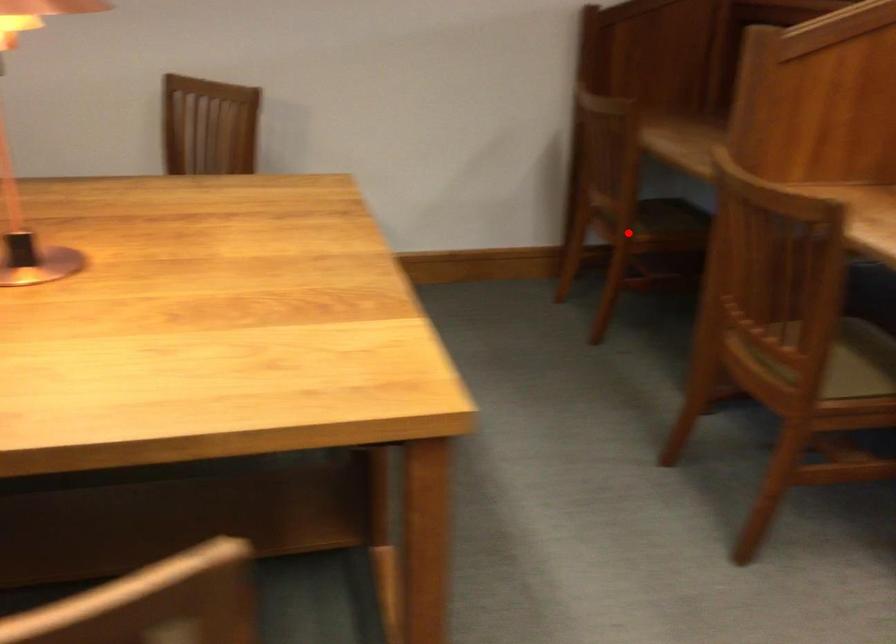
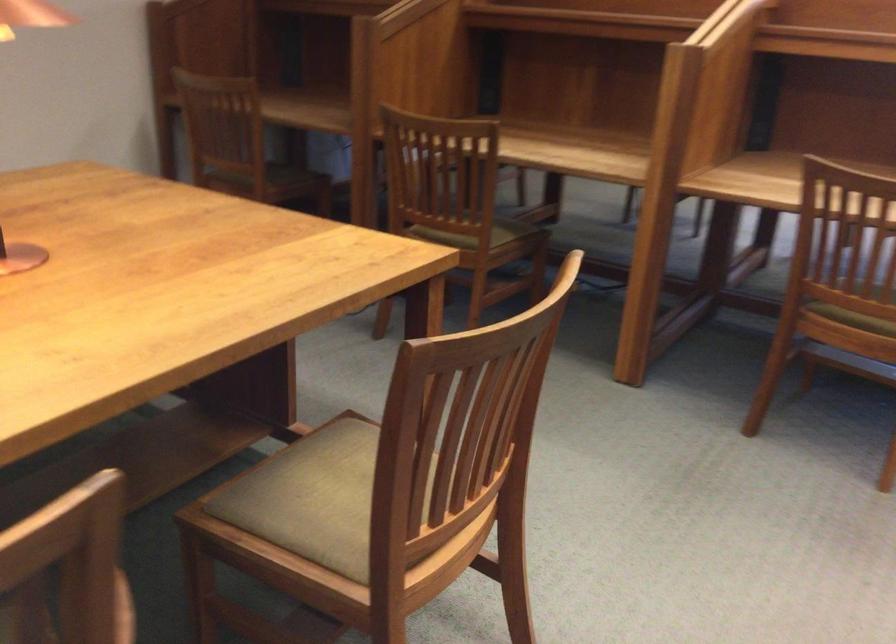
The point at the highlighted location is marked in the first image. Where is the corresponding point in the second image?

(264, 182)